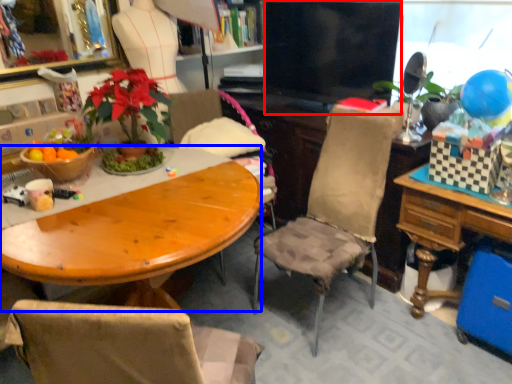
Question: Which point is closer to the camera, television (highlighted by a red box) or desk (highlighted by a blue box)?

Choices:
 (A) television
 (B) desk

Answer: (B)